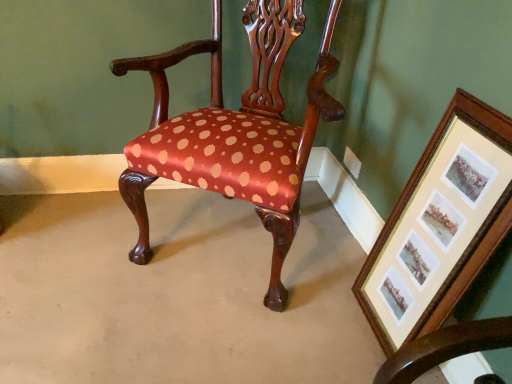
Where is `vacant space underneath satin fabric chair at center (from a real-world perspective)`? This screenshot has width=512, height=384. vacant space underneath satin fabric chair at center (from a real-world perspective) is located at coordinates coord(217,235).